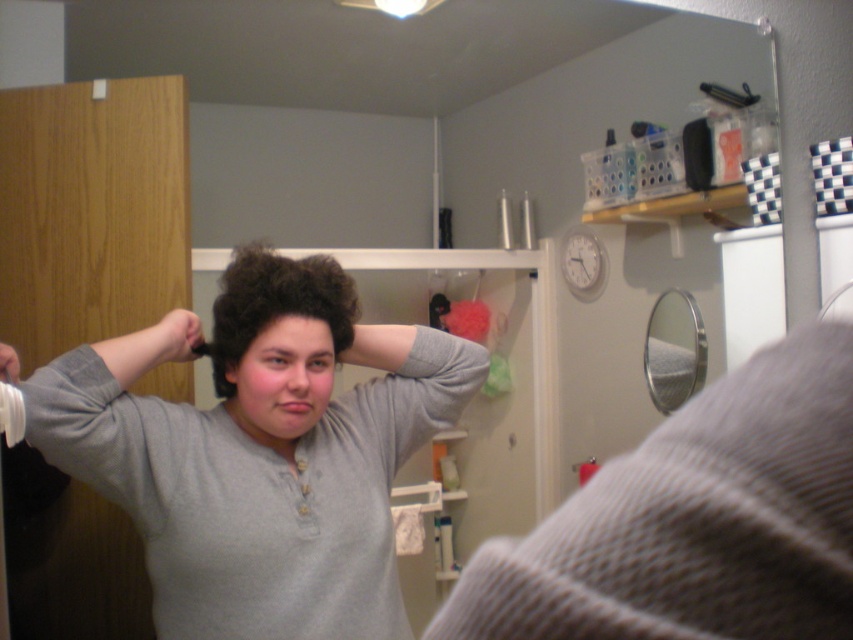
You are organizing the bathroom shelf and need to place the knitted gray sweater at upper right and the smooth gray hairbrush at upper left. Which object should you place first if you want to place one in front of the other?

You should place the knitted gray sweater at upper right first because it is in front of the smooth gray hairbrush at upper left, so placing it first will allow it to be positioned in front.

You are trying to determine the relative positions of the curly brown hair at center and the matte gray hand at upper left in the bathroom scene. Based on the information provided, which object is positioned higher?

The curly brown hair at center is taller than the matte gray hand at upper left, so the curly brown hair at center is positioned higher.